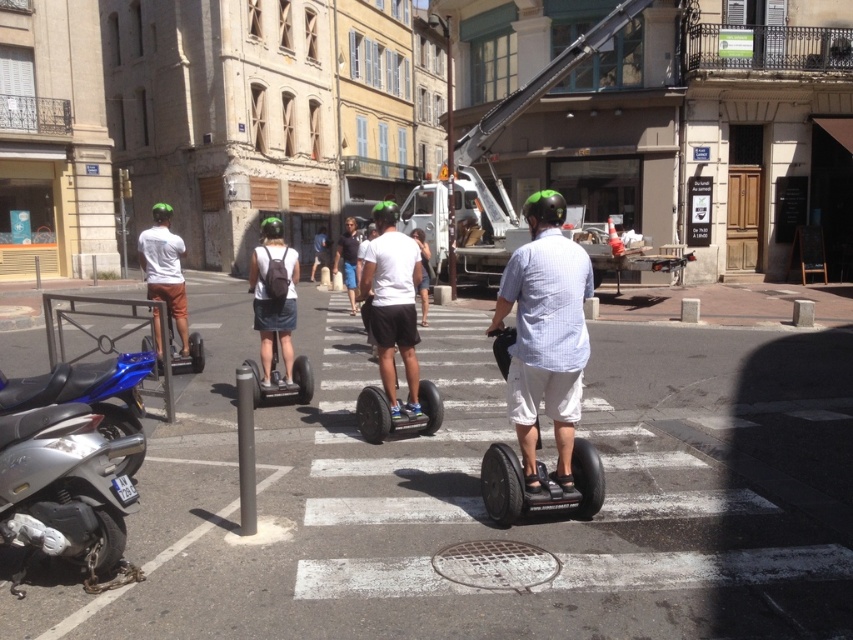
Is matte black backpack at center in front of black matte segway at center?

No.

From the picture: Is matte black backpack at center further to camera compared to black matte segway at center?

Yes.

Is point (273, 308) positioned in front of point (248, 358)?

Yes.

Locate an element on the screen. The height and width of the screenshot is (640, 853). matte black backpack at center is located at coordinates (x=273, y=296).

Does light blue checkered shirt at center have a smaller size compared to dark blue shorts at center?

Yes.

Who is more distant from viewer, (538, 333) or (355, 264)?

Point (355, 264)

Locate an element on the screen. light blue checkered shirt at center is located at coordinates (544, 333).

Does black rubber scooter at center come behind black matte segway at center?

No, it is in front of black matte segway at center.

Is point (358, 403) positioned behind point (276, 330)?

No, (358, 403) is closer to viewer.

Locate an element on the screen. The image size is (853, 640). black rubber scooter at center is located at coordinates (398, 412).